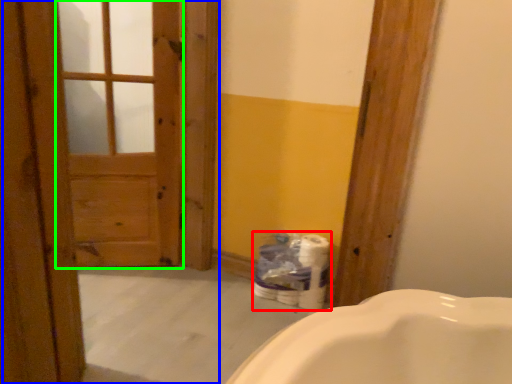
Question: Which object is the farthest from toilet paper (highlighted by a red box)? Choose among these: barn door (highlighted by a blue box) or screen door (highlighted by a green box).

Choices:
 (A) barn door
 (B) screen door

Answer: (B)